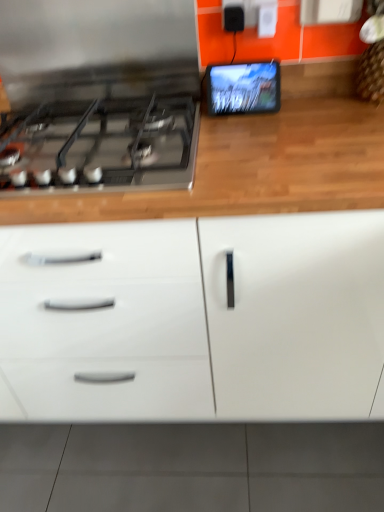
Question: In terms of height, does white glossy cabinet at center look taller or shorter compared to matte black tablet at upper right?

Choices:
 (A) short
 (B) tall

Answer: (B)

Question: Visually, is white glossy cabinet at center positioned to the left or to the right of matte black tablet at upper right?

Choices:
 (A) right
 (B) left

Answer: (B)

Question: Estimate the real-world distances between objects in this image. Which object is closer to the satin black gas stove at left?

Choices:
 (A) matte black tablet at upper right
 (B) white glossy cabinet at center

Answer: (A)

Question: Which object is positioned farthest from the white glossy cabinet at center?

Choices:
 (A) satin black gas stove at left
 (B) matte black tablet at upper right

Answer: (B)